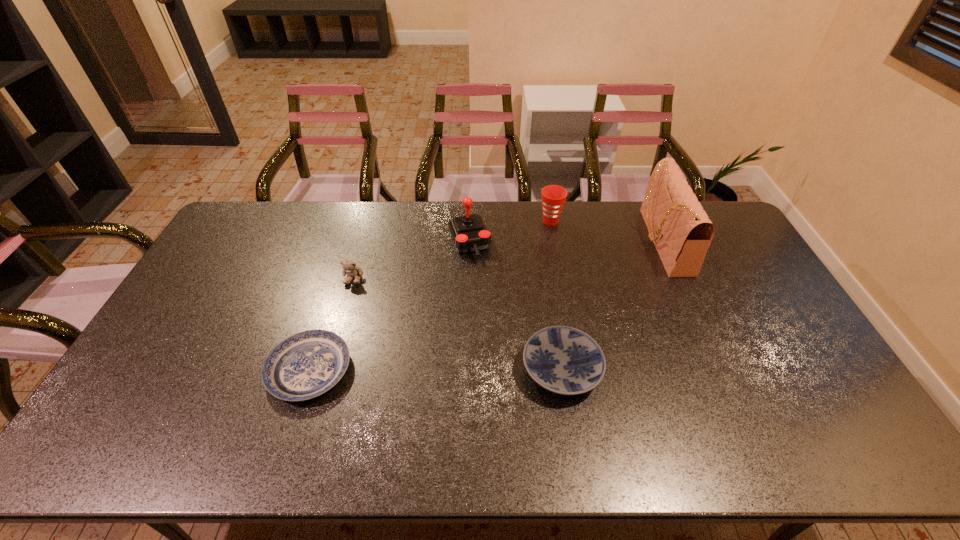
I want to click on blank region between the shortest object and the handbag, so click(x=486, y=306).

Identify the location of unoccupied position between the right plate and the shorter plate. This screenshot has width=960, height=540. (436, 370).

The width and height of the screenshot is (960, 540). I want to click on vacant area that lies between the teddy bear and the right plate, so click(458, 323).

Find the location of a particular element. The width and height of the screenshot is (960, 540). vacant region between the left plate and the third object from left to right is located at coordinates (390, 306).

This screenshot has height=540, width=960. What are the coordinates of `empty space between the taller plate and the shortest object` in the screenshot? It's located at (436, 370).

Locate an element on the screen. The image size is (960, 540). object that can be found as the fourth closest to the third object from left to right is located at coordinates (305, 365).

Locate which object ranks in proximity to the left plate. Please provide its 2D coordinates. Your answer should be formatted as a tuple, i.e. [(x, y)], where the tuple contains the x and y coordinates of a point satisfying the conditions above.

[(349, 267)]

Where is `vacant space that satisfies the following two spatial constraints: 1. on the face of the fifth tallest object; 2. on the left side of the third shortest object`? vacant space that satisfies the following two spatial constraints: 1. on the face of the fifth tallest object; 2. on the left side of the third shortest object is located at coordinates (327, 369).

Where is `vacant space that satisfies the following two spatial constraints: 1. on the front-facing side of the rightmost object; 2. on the face of the teddy bear`? vacant space that satisfies the following two spatial constraints: 1. on the front-facing side of the rightmost object; 2. on the face of the teddy bear is located at coordinates (678, 278).